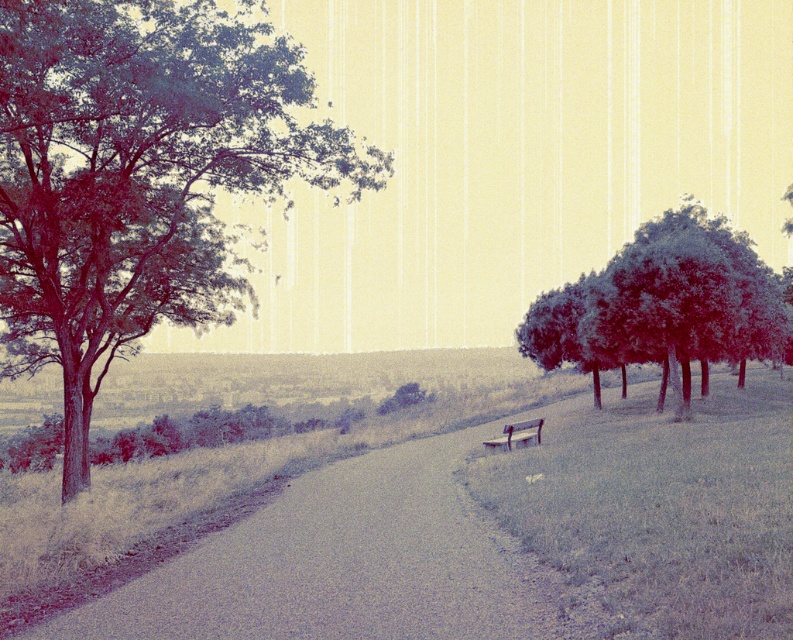
Who is shorter, smooth brown tree at left or wooden park bench at center?

Answer: With less height is wooden park bench at center.

Does smooth brown tree at left have a greater height compared to wooden park bench at center?

Yes.

Is point (18, 282) behind point (527, 420)?

No, it is in front of (527, 420).

At what (x,y) coordinates should I click in order to perform the action: click on smooth brown tree at left. Please return your answer as a coordinate pair (x, y). The height and width of the screenshot is (640, 793). Looking at the image, I should click on (138, 177).

Who is positioned more to the right, smooth brown tree at left or smooth asphalt road at center?

Positioned to the right is smooth asphalt road at center.

Is smooth brown tree at left wider than smooth asphalt road at center?

Indeed, smooth brown tree at left has a greater width compared to smooth asphalt road at center.

Who is more distant from viewer, (336,157) or (416,625)?

The point (336,157) is more distant.

You are a GUI agent. You are given a task and a screenshot of the screen. Output one action in this format:
    pyautogui.click(x=<x>, y=<y>)
    Task: Click on the smooth brown tree at left
    The image size is (793, 640).
    Given the screenshot: What is the action you would take?
    pyautogui.click(x=138, y=177)

Who is more distant from viewer, (443, 524) or (615, 282)?

Positioned behind is point (615, 282).

Between smooth asphalt road at center and smooth green trees at right, which one is positioned higher?

smooth green trees at right is higher up.

Who is more forward, [420,467] or [590,284]?

A: Point [420,467]

Find the location of a particular element. smooth asphalt road at center is located at coordinates (x=343, y=563).